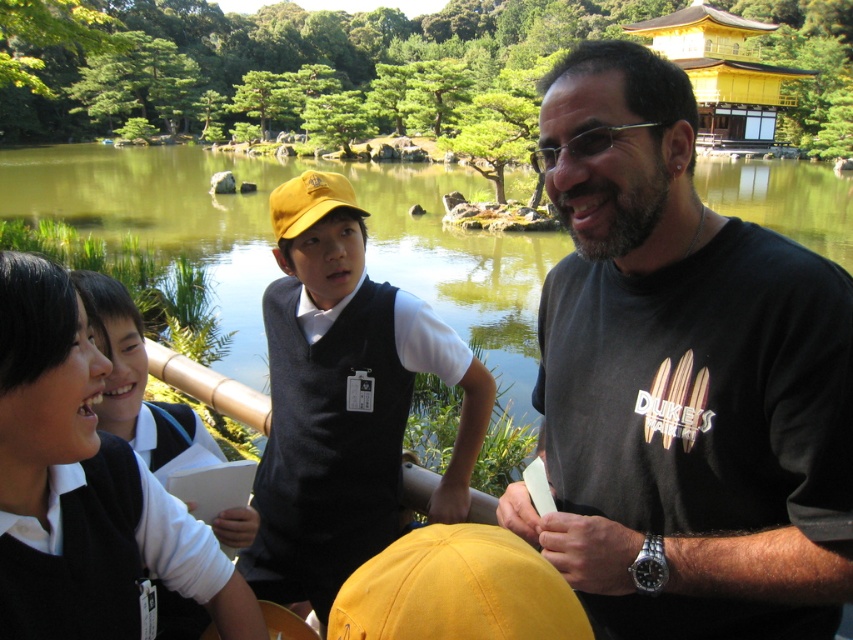
Question: Which point is farther to the camera?

Choices:
 (A) black wool sweater at upper left
 (B) yellow fabric baseball cap at center
 (C) black matte t-shirt at center
 (D) matte yellow cap at center

Answer: (D)

Question: Does matte yellow cap at center have a greater width compared to yellow matte baseball cap at center?

Choices:
 (A) yes
 (B) no

Answer: (A)

Question: Is matte yellow cap at center smaller than black wool sweater at upper left?

Choices:
 (A) no
 (B) yes

Answer: (A)

Question: Based on their relative distances, which object is farther from the yellow matte baseball cap at center?

Choices:
 (A) matte yellow cap at center
 (B) black matte t-shirt at center
 (C) yellow fabric baseball cap at center
 (D) black wool sweater at upper left

Answer: (C)

Question: Which object appears farthest from the camera in this image?

Choices:
 (A) matte yellow cap at center
 (B) black wool sweater at upper left
 (C) yellow fabric baseball cap at center
 (D) black matte t-shirt at center

Answer: (A)

Question: Is black wool sweater at upper left above yellow fabric baseball cap at center?

Choices:
 (A) no
 (B) yes

Answer: (B)